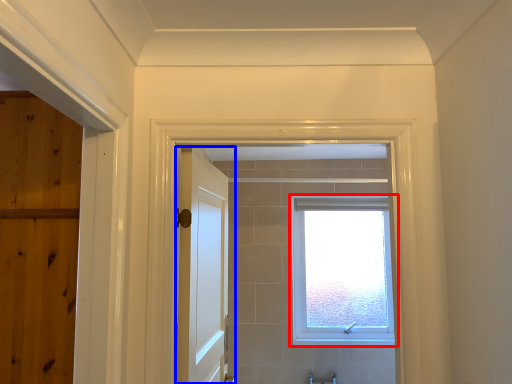
Question: Among these objects, which one is nearest to the camera, window (highlighted by a red box) or door (highlighted by a blue box)?

Choices:
 (A) window
 (B) door

Answer: (B)